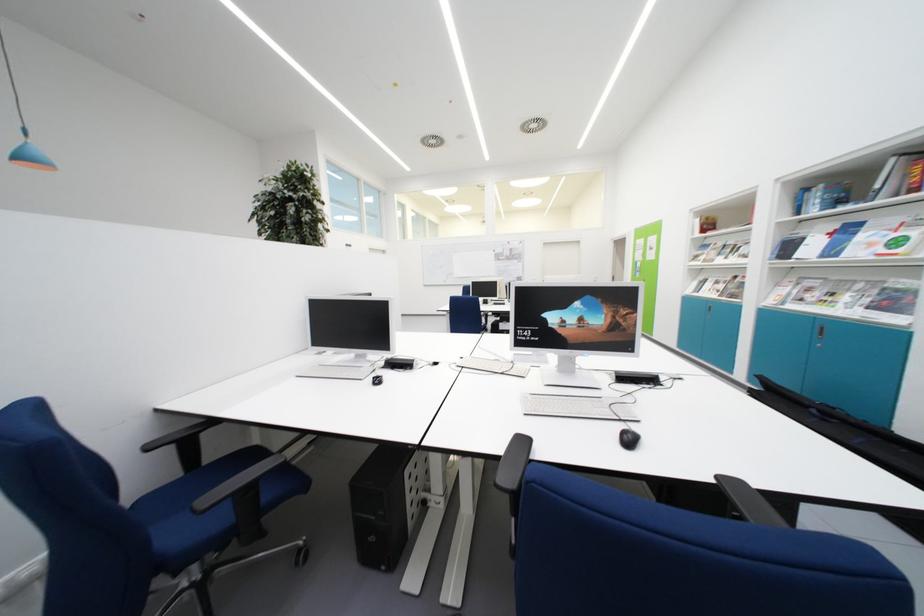
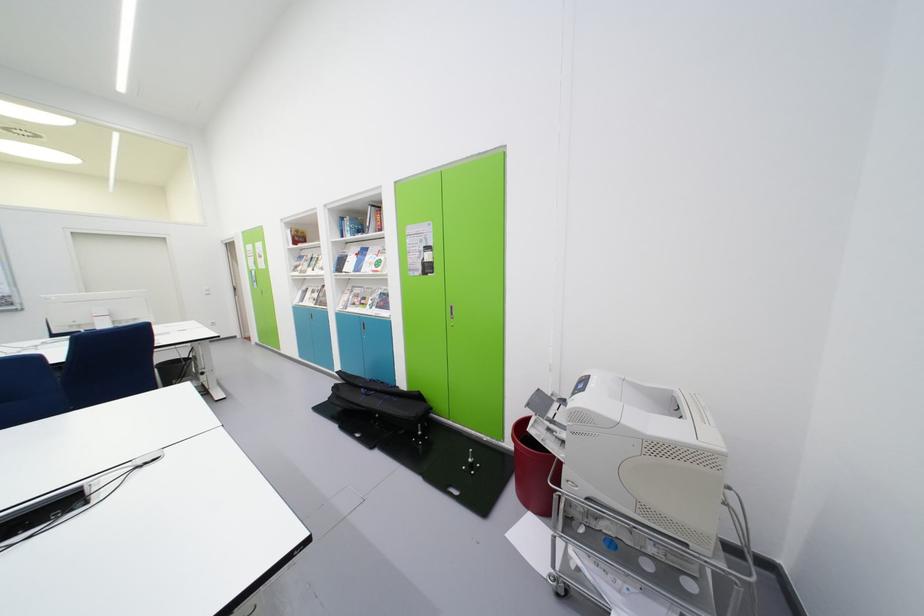
Question: The camera is either moving clockwise (left) or counter-clockwise (right) around the object. The first image is from the beginning of the video and the second image is from the end. Is the camera moving left or right when shooting the video?

Choices:
 (A) Left
 (B) Right

Answer: (A)